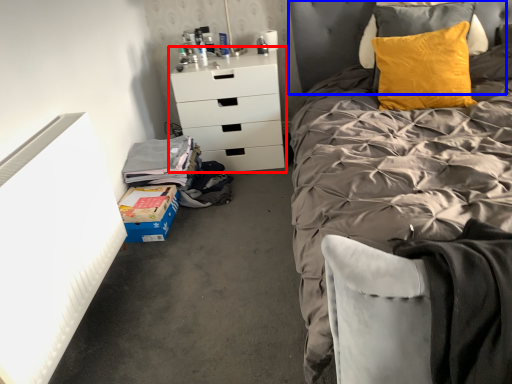
Question: Among these objects, which one is nearest to the camera, chest of drawers (highlighted by a red box) or headboard (highlighted by a blue box)?

Choices:
 (A) chest of drawers
 (B) headboard

Answer: (B)